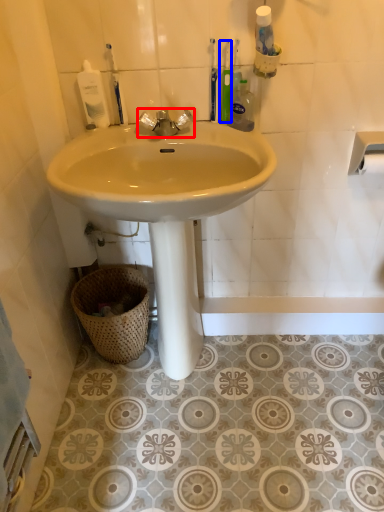
Question: Which point is closer to the camera, tap (highlighted by a red box) or toothbrush (highlighted by a blue box)?

Choices:
 (A) tap
 (B) toothbrush

Answer: (A)